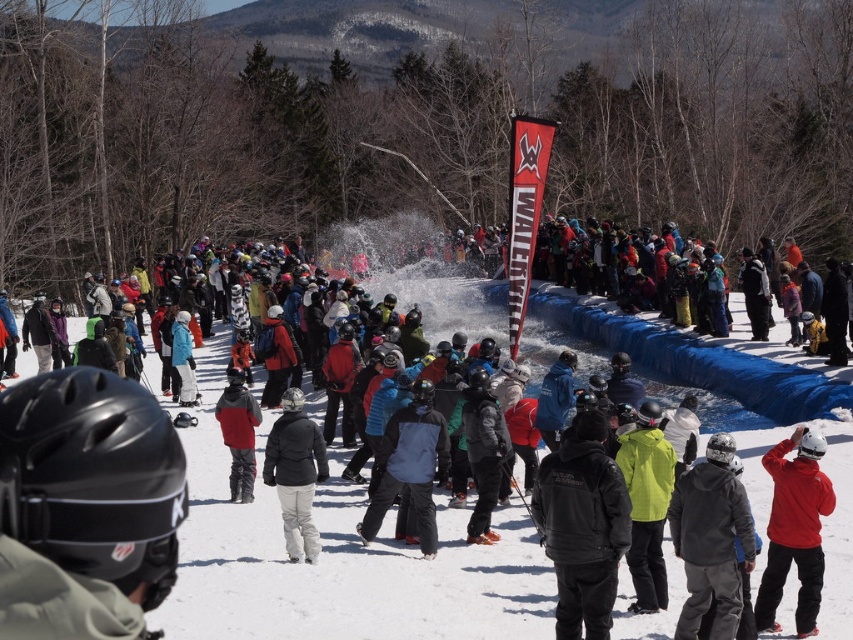
Between red matte jacket at center and red jacket at center, which one appears on the right side from the viewer's perspective?

From the viewer's perspective, red matte jacket at center appears more on the right side.

Describe the element at coordinates (793, 529) in the screenshot. The image size is (853, 640). I see `red matte jacket at center` at that location.

Find the location of a particular element. This screenshot has height=640, width=853. red matte jacket at center is located at coordinates [793, 529].

Is point (334, 461) closer to viewer compared to point (759, 620)?

No, (334, 461) is behind (759, 620).

Who is higher up, blue tarp at center or red matte jacket at center?

blue tarp at center

Locate an element on the screen. The width and height of the screenshot is (853, 640). blue tarp at center is located at coordinates (335, 554).

Can you confirm if black matte jacket at center is positioned to the right of red jacket at center?

Indeed, black matte jacket at center is positioned on the right side of red jacket at center.

Is black matte jacket at center positioned in front of red jacket at center?

Yes.

Which is behind, point (311, 477) or point (241, 420)?

Point (241, 420)

Where is `black matte jacket at center`? The image size is (853, 640). black matte jacket at center is located at coordinates (294, 474).